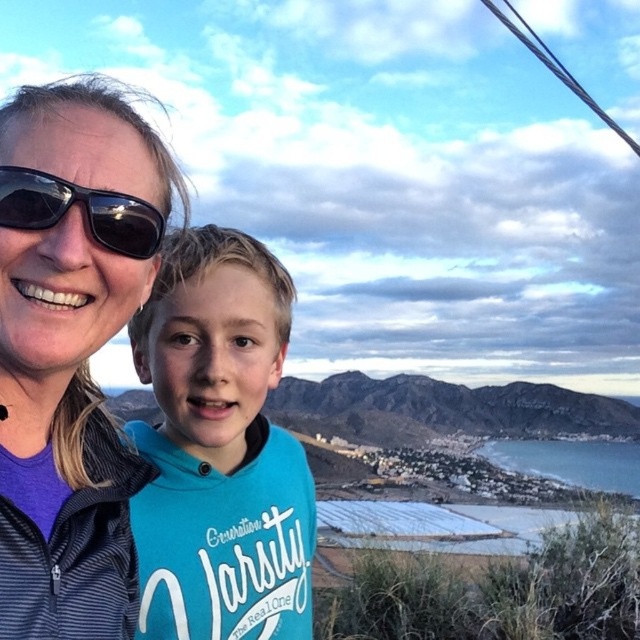
Which of these two, teal jersey at center or black plastic sunglasses at upper left, stands taller?

Standing taller between the two is teal jersey at center.

The image size is (640, 640). Describe the element at coordinates (220, 449) in the screenshot. I see `teal jersey at center` at that location.

Find the location of a particular element. The image size is (640, 640). teal jersey at center is located at coordinates (220, 449).

Which of these two, matte black jacket at upper left or black plastic sunglasses at upper left, stands taller?

matte black jacket at upper left

Does matte black jacket at upper left have a larger size compared to black plastic sunglasses at upper left?

Yes, matte black jacket at upper left is bigger than black plastic sunglasses at upper left.

I want to click on matte black jacket at upper left, so click(72, 348).

Is matte black jacket at upper left shorter than teal jersey at center?

Incorrect, matte black jacket at upper left's height does not fall short of teal jersey at center's.

This screenshot has height=640, width=640. What are the coordinates of `matte black jacket at upper left` in the screenshot? It's located at (72, 348).